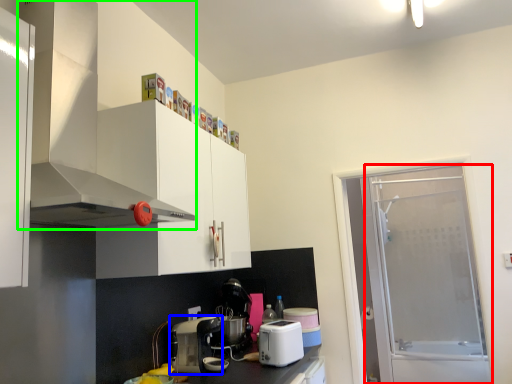
Question: Estimate the real-world distances between objects in this image. Which object is closer to screen door (highlighted by a red box), kitchen appliance (highlighted by a blue box) or home appliance (highlighted by a green box)?

Choices:
 (A) kitchen appliance
 (B) home appliance

Answer: (A)